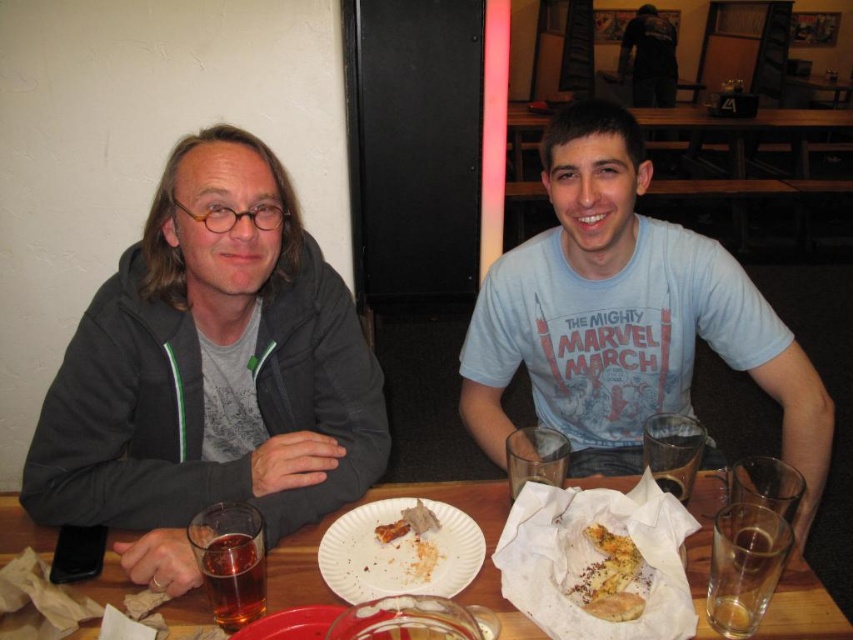
Question: Does golden crispy chicken at center have a smaller size compared to brown crumbly bread at center?

Choices:
 (A) yes
 (B) no

Answer: (A)

Question: Considering the relative positions of white paper plate at center and brown crumbly bread at center in the image provided, where is white paper plate at center located with respect to brown crumbly bread at center?

Choices:
 (A) left
 (B) right

Answer: (A)

Question: Which point is farther from the camera taking this photo?

Choices:
 (A) (460, 561)
 (B) (624, 586)
 (C) (236, 259)

Answer: (C)

Question: Among these points, which one is nearest to the camera?

Choices:
 (A) (430, 513)
 (B) (247, 563)

Answer: (B)

Question: Considering the real-world distances, which object is farthest from the translucent amber liquid at lower left?

Choices:
 (A) brown crumbly bread at center
 (B) white paper plate at center
 (C) light blue cotton shirt at center

Answer: (C)

Question: Does light blue cotton shirt at center appear over white paper plate at center?

Choices:
 (A) yes
 (B) no

Answer: (A)